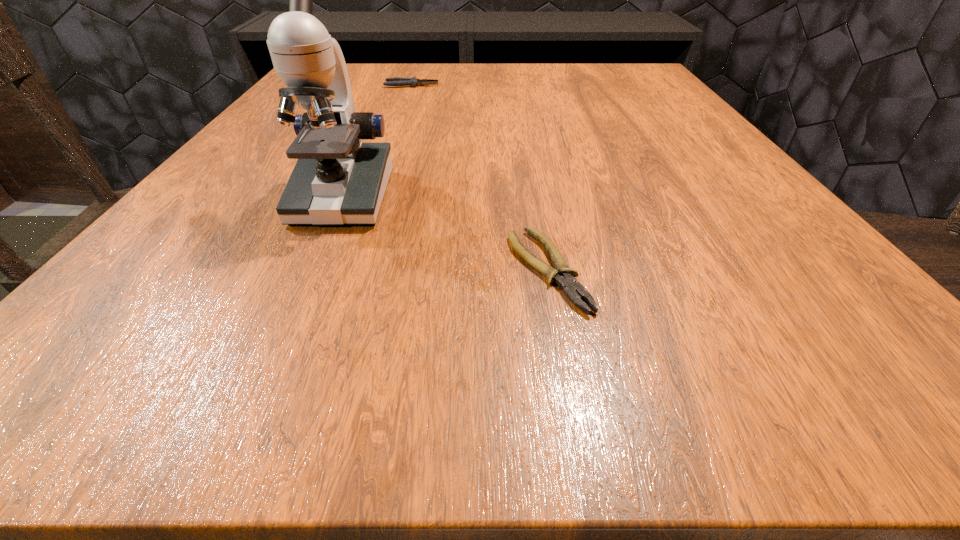
The image size is (960, 540). I want to click on free point that satisfies the following two spatial constraints: 1. at the gripping part of the shortest object; 2. on the left side of the taller pliers, so click(346, 269).

Locate an element on the screen. This screenshot has width=960, height=540. vacant space that satisfies the following two spatial constraints: 1. on the back side of the nearer pliers; 2. at the gripping part of the farthest object is located at coordinates coord(515,85).

You are a GUI agent. You are given a task and a screenshot of the screen. Output one action in this format:
    pyautogui.click(x=<x>, y=<y>)
    Task: Click on the free space that satisfies the following two spatial constraints: 1. at the eyepiece of the shortest object; 2. on the right side of the microscope
    The image size is (960, 540).
    Given the screenshot: What is the action you would take?
    pyautogui.click(x=309, y=269)

The height and width of the screenshot is (540, 960). I want to click on free space that satisfies the following two spatial constraints: 1. at the gripping part of the shortest object; 2. on the left side of the farthest object, so click(x=346, y=269).

Find the location of `free point that satisfies the following two spatial constraints: 1. at the gripping part of the taller pliers; 2. at the eyepiece of the second nearest object`. free point that satisfies the following two spatial constraints: 1. at the gripping part of the taller pliers; 2. at the eyepiece of the second nearest object is located at coordinates pos(372,197).

Locate an element on the screen. This screenshot has width=960, height=540. vacant region that satisfies the following two spatial constraints: 1. at the gripping part of the farther pliers; 2. on the left side of the nearer pliers is located at coordinates (346, 269).

Locate an element on the screen. free space that satisfies the following two spatial constraints: 1. at the gripping part of the second tallest object; 2. at the eyepiece of the microscope is located at coordinates (372, 197).

At what (x,y) coordinates should I click in order to perform the action: click on vacant space that satisfies the following two spatial constraints: 1. at the gripping part of the second shortest object; 2. on the right side of the shortest object. Please return your answer as a coordinate pair (x, y). This screenshot has height=540, width=960. Looking at the image, I should click on (346, 269).

You are a GUI agent. You are given a task and a screenshot of the screen. Output one action in this format:
    pyautogui.click(x=<x>, y=<y>)
    Task: Click on the free space that satisfies the following two spatial constraints: 1. at the gripping part of the farthest object; 2. at the eyepiece of the microscope
    This screenshot has width=960, height=540.
    Given the screenshot: What is the action you would take?
    [x=372, y=197]

Image resolution: width=960 pixels, height=540 pixels. What are the coordinates of `vacant space that satisfies the following two spatial constraints: 1. at the gripping part of the shortest object; 2. on the right side of the left pliers` in the screenshot? It's located at (346, 269).